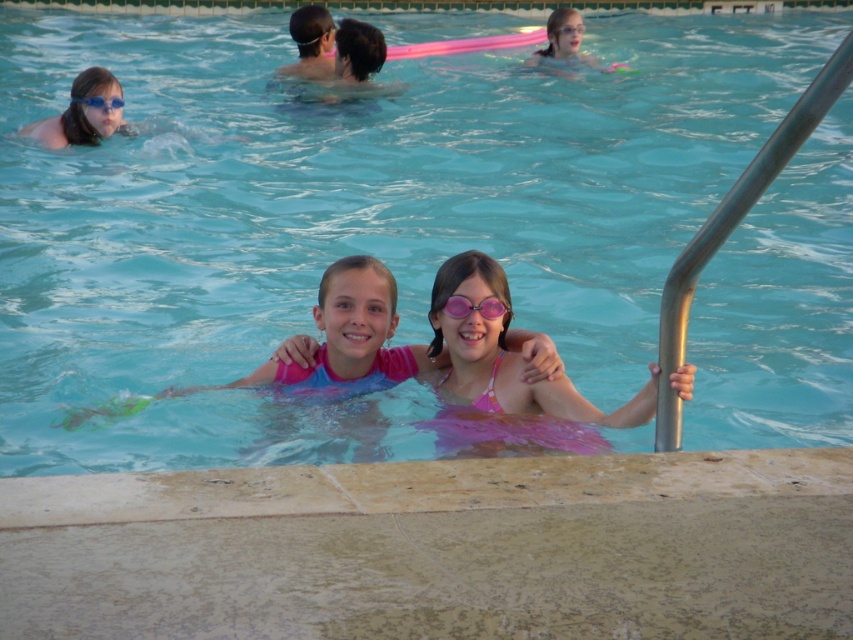
Does pink matte swimsuit at center appear on the right side of matte blue goggles at upper left?

Indeed, pink matte swimsuit at center is positioned on the right side of matte blue goggles at upper left.

Can you confirm if pink matte swimsuit at center is bigger than matte blue goggles at upper left?

Indeed, pink matte swimsuit at center has a larger size compared to matte blue goggles at upper left.

Is point (207, 388) closer to camera compared to point (99, 76)?

Yes.

This screenshot has height=640, width=853. Identify the location of pink matte swimsuit at center. (346, 337).

Is pink matte goggles at center positioned at the back of matte pink goggles at upper left?

No, pink matte goggles at center is closer to the viewer.

Which is below, pink matte goggles at center or matte pink goggles at upper left?

pink matte goggles at center is below.

The width and height of the screenshot is (853, 640). What do you see at coordinates (474, 307) in the screenshot?
I see `pink matte goggles at center` at bounding box center [474, 307].

Find the location of a particular element. This screenshot has height=640, width=853. pink matte goggles at center is located at coordinates (474, 307).

Looking at this image, does matte blue goggles at upper left appear over matte pink goggles at upper left?

No.

Is point (103, 83) in front of point (102, 99)?

Yes.

Which is behind, point (105, 128) or point (86, 100)?

The point (105, 128) is behind.

I want to click on matte blue goggles at upper left, so click(x=83, y=113).